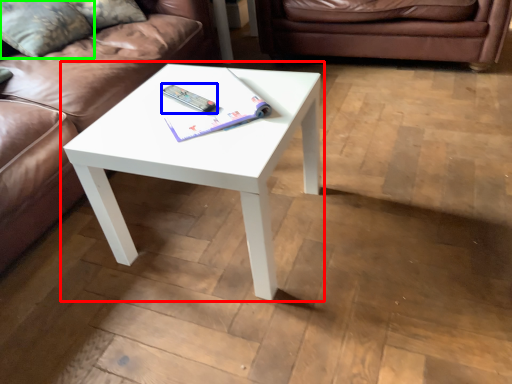
Question: Based on their relative distances, which object is nearer to coffee table (highlighted by a red box)? Choose from remote (highlighted by a blue box) and pillow (highlighted by a green box).

Choices:
 (A) remote
 (B) pillow

Answer: (A)